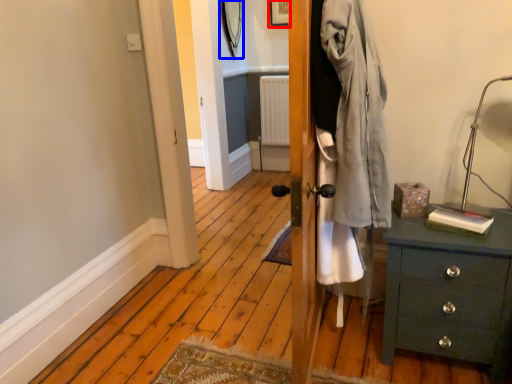
Question: Which object appears farthest to the camera in this image, picture frame (highlighted by a red box) or mirror (highlighted by a blue box)?

Choices:
 (A) picture frame
 (B) mirror

Answer: (A)